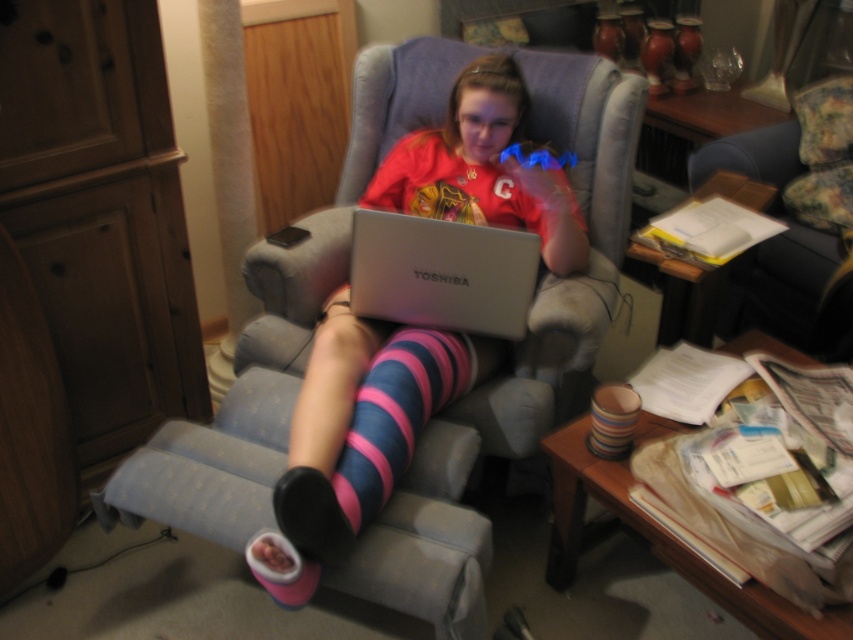
Question: Does pink striped socks at center have a lesser width compared to silver metallic laptop at center?

Choices:
 (A) yes
 (B) no

Answer: (B)

Question: Where is pink striped socks at center located in relation to pink striped sock at center in the image?

Choices:
 (A) below
 (B) above

Answer: (B)

Question: Which point is farther to the camera?

Choices:
 (A) (390, 481)
 (B) (448, 282)

Answer: (B)

Question: Estimate the real-world distances between objects in this image. Which object is closer to the pink striped socks at center?

Choices:
 (A) silver metallic laptop at center
 (B) pink striped sock at center

Answer: (B)

Question: Is silver metallic laptop at center below pink striped sock at center?

Choices:
 (A) no
 (B) yes

Answer: (A)

Question: Which point is farther to the camera?

Choices:
 (A) pyautogui.click(x=347, y=502)
 (B) pyautogui.click(x=347, y=490)

Answer: (B)